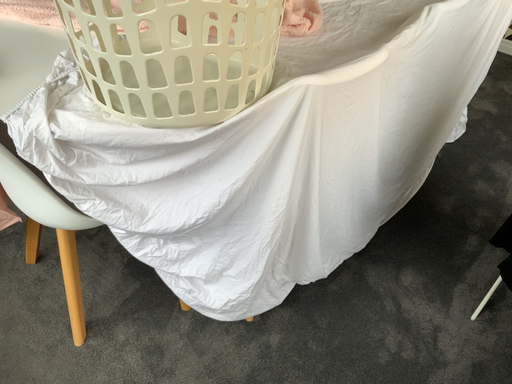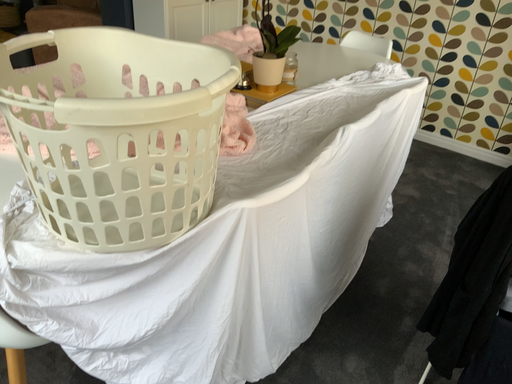
Question: How did the camera likely rotate when shooting the video?

Choices:
 (A) rotated left
 (B) rotated right

Answer: (B)